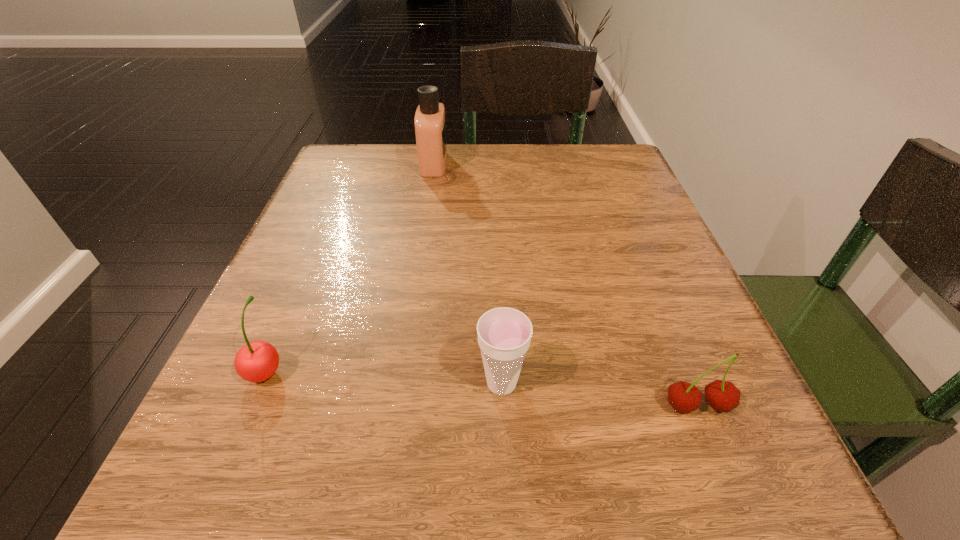
Identify the location of free space that is in between the cup and the second object from left to right. This screenshot has height=540, width=960. (468, 274).

Locate an element on the screen. Image resolution: width=960 pixels, height=540 pixels. free space between the third object from left to right and the left cherry is located at coordinates (384, 377).

Where is `vacant area that lies between the perfume and the rightmost object`? The width and height of the screenshot is (960, 540). vacant area that lies between the perfume and the rightmost object is located at coordinates (565, 285).

Locate an element on the screen. vacant area that lies between the left cherry and the third object from right to left is located at coordinates (350, 267).

You are a GUI agent. You are given a task and a screenshot of the screen. Output one action in this format:
    pyautogui.click(x=<x>, y=<y>)
    Task: Click on the vacant area between the perfume and the left cherry
    
    Given the screenshot: What is the action you would take?
    (x=350, y=267)

The width and height of the screenshot is (960, 540). Identify the location of free space between the cup and the right cherry. (599, 395).

Find the location of a particular element. This screenshot has width=960, height=540. vacant point located between the perfume and the second object from right to left is located at coordinates (468, 274).

I want to click on free spot between the left cherry and the second object from left to right, so click(350, 267).

Identify the location of blank region between the right cherry and the leftmost object. Image resolution: width=960 pixels, height=540 pixels. (482, 388).

At what (x,y) coordinates should I click in order to perform the action: click on unoccupied area between the rightmost object and the cup. Please return your answer as a coordinate pair (x, y). The image size is (960, 540). Looking at the image, I should click on (599, 395).